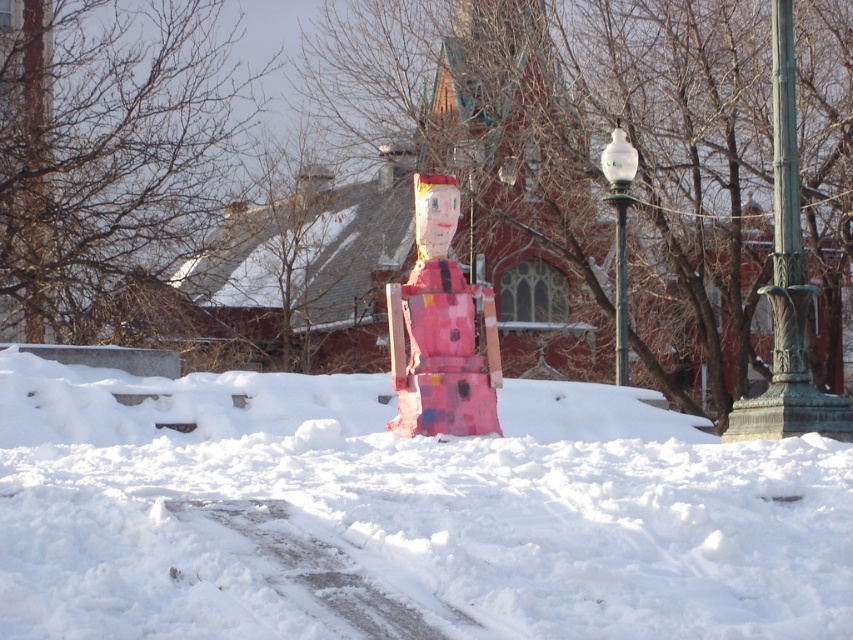
Can you confirm if white fluffy snow at center is positioned to the left of painted cardboard figure at center?

Correct, you'll find white fluffy snow at center to the left of painted cardboard figure at center.

Which of these two, white fluffy snow at center or painted cardboard figure at center, stands taller?

With more height is painted cardboard figure at center.

You are a GUI agent. You are given a task and a screenshot of the screen. Output one action in this format:
    pyautogui.click(x=<x>, y=<y>)
    Task: Click on the white fluffy snow at center
    Image resolution: width=853 pixels, height=640 pixels.
    Given the screenshot: What is the action you would take?
    pyautogui.click(x=403, y=515)

Between point (440, 280) and point (618, 369), which one is positioned behind?

Point (618, 369)

Can you confirm if painted cardboard figure at center is wider than white glass lamp post at upper right?

Indeed, painted cardboard figure at center has a greater width compared to white glass lamp post at upper right.

Describe the element at coordinates (440, 330) in the screenshot. I see `painted cardboard figure at center` at that location.

Locate an element on the screen. This screenshot has width=853, height=640. painted cardboard figure at center is located at coordinates (440, 330).

Can you confirm if painted cardboard figure at center is wider than metallic green pole at center-right?

Yes, painted cardboard figure at center is wider than metallic green pole at center-right.

Locate an element on the screen. The image size is (853, 640). painted cardboard figure at center is located at coordinates (440, 330).

I want to click on painted cardboard figure at center, so click(440, 330).

I want to click on painted cardboard figure at center, so click(x=440, y=330).